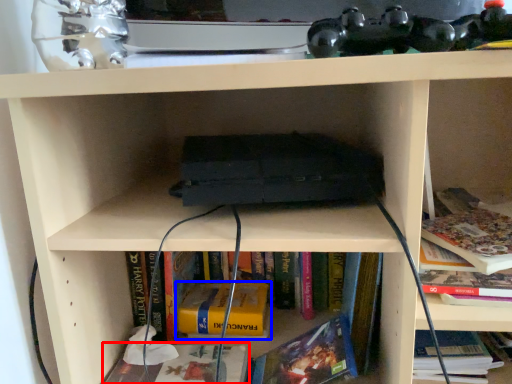
Question: Which object appears closest to the camera in this image, book (highlighted by a red box) or book (highlighted by a blue box)?

Choices:
 (A) book
 (B) book

Answer: (A)